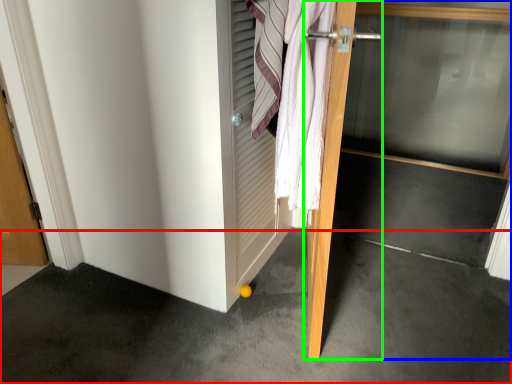
Question: Which object is the closest to the concrete (highlighted by a red box)? Choose among these: door (highlighted by a blue box) or door (highlighted by a green box).

Choices:
 (A) door
 (B) door

Answer: (B)